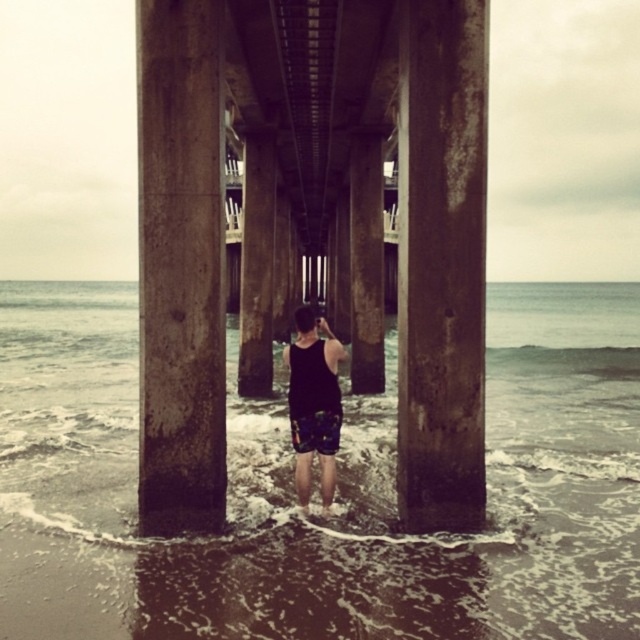
You are a photographer planning to capture a shot of the sandy water at lower center and the black matte tank top at center. Based on the scene description, which object appears larger in the image?

The sandy water at lower center appears larger in the image because it is much taller than the black matte tank top at center.

You are a photographer trying to capture a wide shot of the ocean from under the pier. The two pillars, dark gray concrete pillar at center and rusty concrete pillar at center, are in your way. If your camera has a 20 feet wide field of view, can you fit both pillars into the shot without moving your position?

The dark gray concrete pillar at center and rusty concrete pillar at center are 31.31 feet apart. Since the distance between them exceeds the camera field of view by 11.31 feet, you cannot fit both pillars into the shot without moving your position.

You are a photographer trying to capture the view through the pillars. Since you want to ensure both the dark gray concrete pillar at center and the rusty concrete pillar at center are clearly visible in your shot, which pillar should you position closer to the camera to avoid obstruction?

The dark gray concrete pillar at center is bigger than the rusty concrete pillar at center. To avoid obstruction, position the smaller rusty concrete pillar at center closer to the camera so its smaller size allows both pillars to be visible without overlapping.